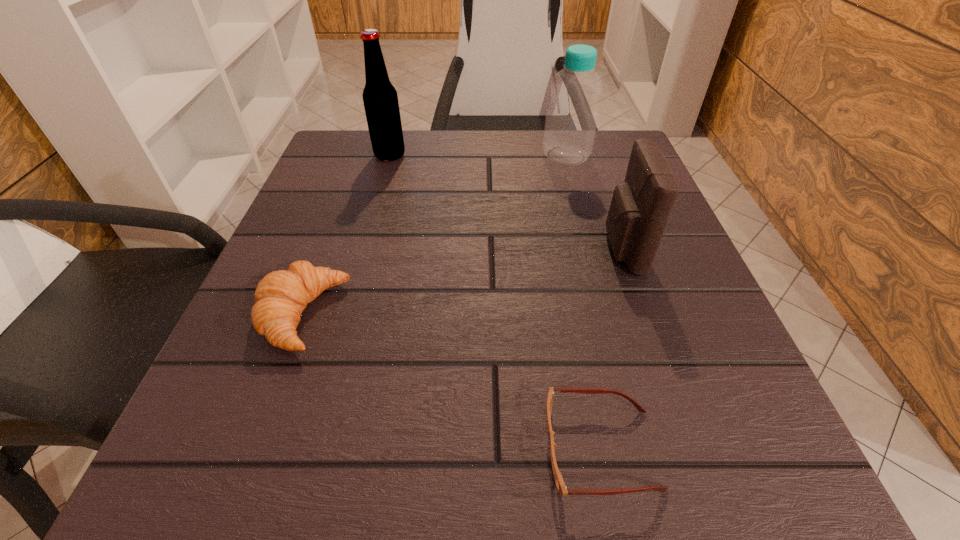
Locate an element on the screen. beer bottle is located at coordinates (380, 98).

Identify the location of bottle. This screenshot has width=960, height=540. (571, 121).

The height and width of the screenshot is (540, 960). I want to click on pouch, so click(x=640, y=207).

Image resolution: width=960 pixels, height=540 pixels. Identify the location of the second shortest object. (281, 296).

Find the location of a particular element. spectacles is located at coordinates (560, 484).

You are a GUI agent. You are given a task and a screenshot of the screen. Output one action in this format:
    pyautogui.click(x=<x>, y=<y>)
    Task: Click on the shortest object
    
    Given the screenshot: What is the action you would take?
    pyautogui.click(x=560, y=484)

You are a GUI agent. You are given a task and a screenshot of the screen. Output one action in this format:
    pyautogui.click(x=<x>, y=<y>)
    Task: Click on the vacant point located 0.080m on the back of the beer bottle
    The image size is (960, 540).
    Given the screenshot: What is the action you would take?
    (396, 131)

Find the location of a particular element. free space located on the right of the bottle is located at coordinates (636, 156).

In order to click on free location located 0.060m with an open flap on the third shortest object in this screenshot , I will do `click(569, 249)`.

Where is `free space located 0.360m with an open flap on the third shortest object`? Image resolution: width=960 pixels, height=540 pixels. free space located 0.360m with an open flap on the third shortest object is located at coordinates (394, 249).